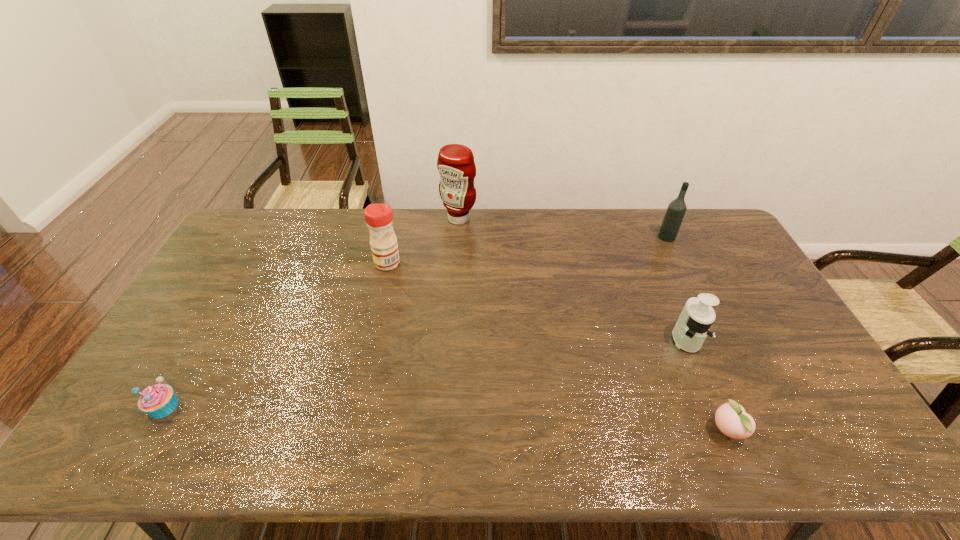
In the image, there is a desktop. Find the location of `vacant space at the far edge`. vacant space at the far edge is located at coordinates (642, 209).

Find the location of a particular element. This screenshot has width=960, height=540. vacant space at the near edge is located at coordinates (714, 457).

You are a GUI agent. You are given a task and a screenshot of the screen. Output one action in this format:
    pyautogui.click(x=<x>, y=<y>)
    Task: Click on the vacant space at the right edge of the desktop
    Image resolution: width=960 pixels, height=540 pixels.
    Given the screenshot: What is the action you would take?
    pyautogui.click(x=743, y=281)

Locate an element on the screen. This screenshot has width=960, height=540. vacant space at the near right corner of the desktop is located at coordinates (804, 426).

Where is `free space between the leftmost object and the peach`? free space between the leftmost object and the peach is located at coordinates (445, 418).

Locate an element on the screen. This screenshot has width=960, height=540. empty location between the left condiment and the muffin is located at coordinates pos(276,335).

You are a GUI agent. You are given a task and a screenshot of the screen. Output one action in this format:
    pyautogui.click(x=<x>, y=<y>)
    Task: Click on the vacant area between the muffin and the rightmost object
    
    Given the screenshot: What is the action you would take?
    pyautogui.click(x=415, y=322)

This screenshot has height=540, width=960. Find the location of `unoccupied position between the muffin and the shorter condiment`. unoccupied position between the muffin and the shorter condiment is located at coordinates (276, 335).

Where is `free area in between the second farthest object and the juicer`? free area in between the second farthest object and the juicer is located at coordinates (676, 288).

This screenshot has height=540, width=960. What are the coordinates of `vacant space that's between the peach and the farthest object` in the screenshot? It's located at (592, 325).